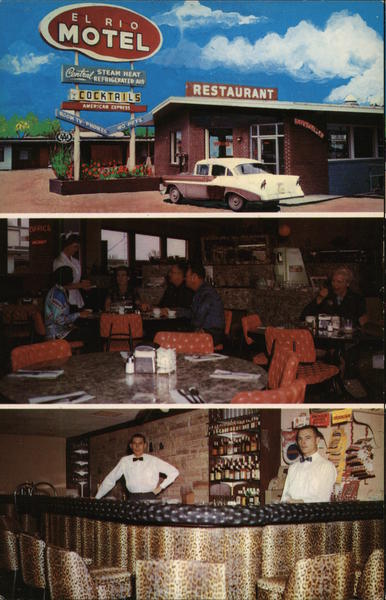
I want to click on windows, so click(174, 250), click(140, 250), click(114, 247), click(18, 235), click(337, 150), click(359, 144).